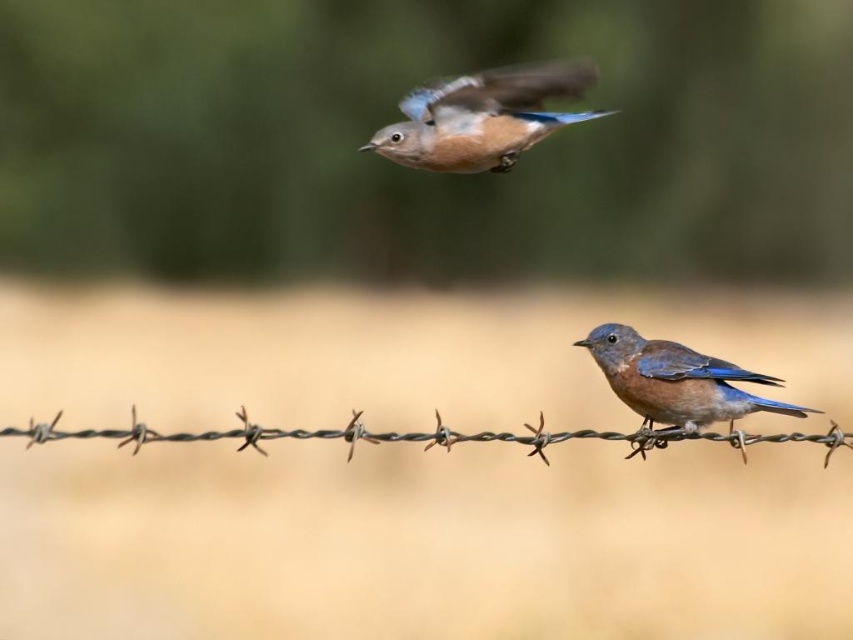
Question: Is blue glossy bird at upper center to the left of blue glossy bird at center from the viewer's perspective?

Choices:
 (A) no
 (B) yes

Answer: (B)

Question: Does blue glossy bird at upper center lie behind blue glossy bird at center?

Choices:
 (A) yes
 (B) no

Answer: (B)

Question: Which of the following is the closest to the observer?

Choices:
 (A) (715, 374)
 (B) (549, 88)

Answer: (B)

Question: Is blue glossy bird at upper center wider than blue glossy bird at center?

Choices:
 (A) yes
 (B) no

Answer: (B)